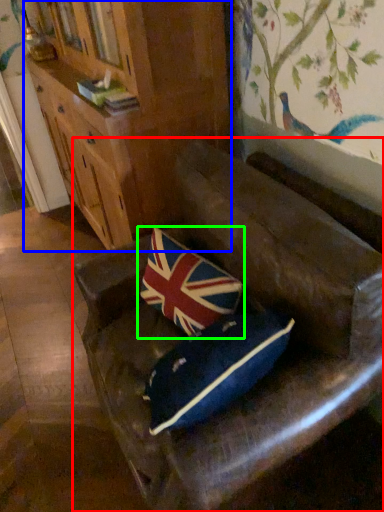
Question: Estimate the real-world distances between objects in this image. Which object is farther from furniture (highlighted by a red box), cabinetry (highlighted by a blue box) or pillow (highlighted by a green box)?

Choices:
 (A) cabinetry
 (B) pillow

Answer: (A)